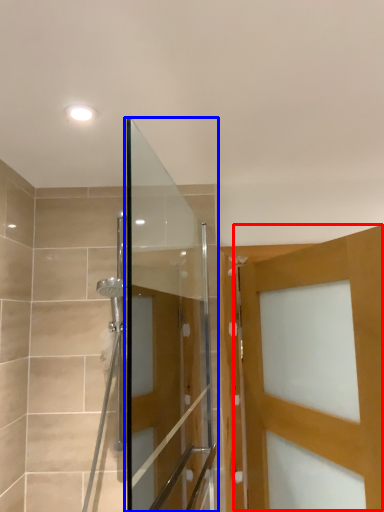
Question: Which object appears closest to the camera in this image, door (highlighted by a red box) or screen door (highlighted by a blue box)?

Choices:
 (A) door
 (B) screen door

Answer: (B)